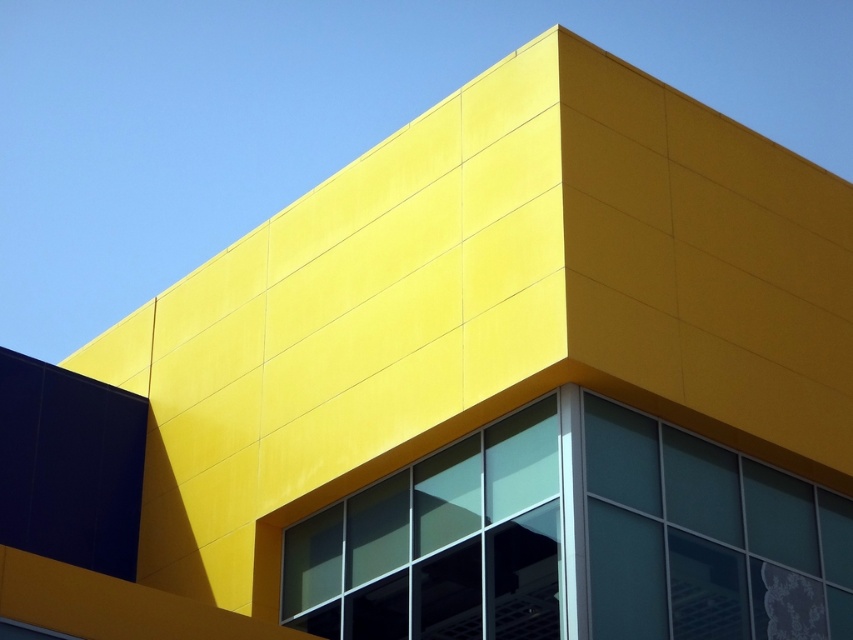
Does point (828, 612) come farther from viewer compared to point (473, 440)?

No, (828, 612) is closer to viewer.

Does clear glass window at center appear on the right side of transparent glass window at center?

Yes, clear glass window at center is to the right of transparent glass window at center.

Who is more forward, (769, 566) or (500, 531)?

Positioned in front is point (500, 531).

Where is `clear glass window at center`? The image size is (853, 640). clear glass window at center is located at coordinates (575, 540).

Does clear glass window at center have a greater height compared to transparent glass window at lower right?

Correct, clear glass window at center is much taller as transparent glass window at lower right.

Does point (360, 509) come behind point (636, 456)?

That is True.

The width and height of the screenshot is (853, 640). I want to click on clear glass window at center, so click(x=575, y=540).

In the scene shown: Does transparent glass window at lower right have a greater width compared to transparent glass window at center?

Yes, transparent glass window at lower right is wider than transparent glass window at center.

Does point (811, 593) lie behind point (556, 608)?

Yes, point (811, 593) is behind point (556, 608).

This screenshot has height=640, width=853. Find the location of `transparent glass window at lower right`. transparent glass window at lower right is located at coordinates (706, 538).